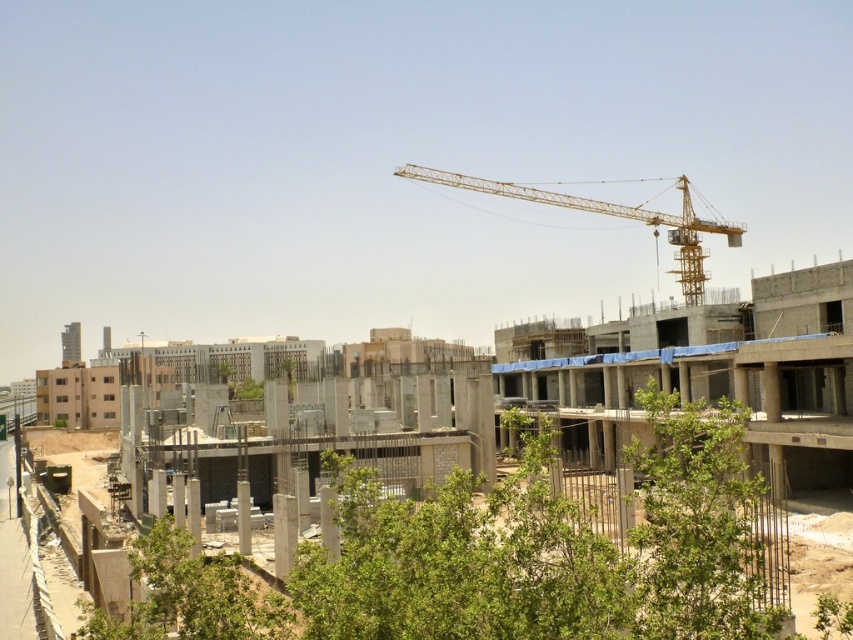
Question: Which point appears farthest from the camera in this image?

Choices:
 (A) (433, 179)
 (B) (775, 358)

Answer: (A)

Question: Among these objects, which one is farthest from the camera?

Choices:
 (A) yellow metallic crane at upper center
 (B) concrete at center

Answer: (A)

Question: Can you confirm if concrete at center is positioned above yellow metallic crane at upper center?

Choices:
 (A) yes
 (B) no

Answer: (B)

Question: Does concrete at center appear under yellow metallic crane at upper center?

Choices:
 (A) yes
 (B) no

Answer: (A)

Question: Observing the image, what is the correct spatial positioning of concrete at center in reference to yellow metallic crane at upper center?

Choices:
 (A) right
 (B) left

Answer: (B)

Question: Which of the following is the farthest from the observer?

Choices:
 (A) tap(785, 397)
 (B) tap(561, 196)

Answer: (B)